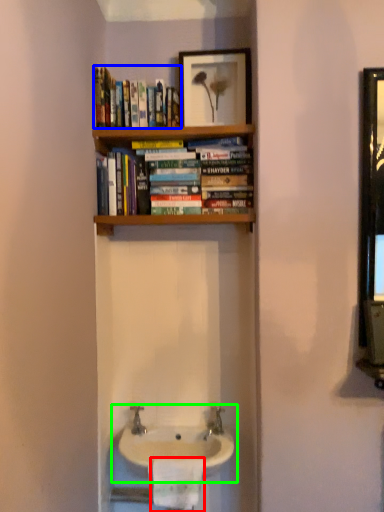
Question: Which object is the farthest from toilet paper (highlighted by a red box)? Choose among these: book (highlighted by a blue box) or sink (highlighted by a green box).

Choices:
 (A) book
 (B) sink

Answer: (A)